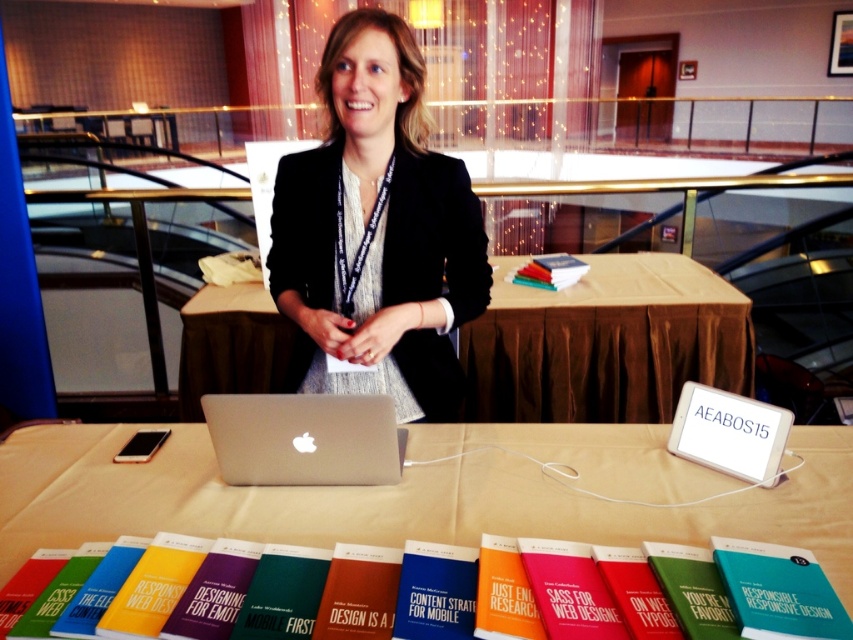
Question: Among these points, which one is farthest from the camera?

Choices:
 (A) (234, 392)
 (B) (424, 589)
 (C) (534, 260)
 (D) (386, 628)

Answer: (C)

Question: Which point is closer to the camera?

Choices:
 (A) (309, 467)
 (B) (581, 275)

Answer: (A)

Question: Is white plastic tablet at center bigger than blue hardcover book at center?

Choices:
 (A) no
 (B) yes

Answer: (B)

Question: Does black textured blazer at center have a larger size compared to matte green book at lower right?

Choices:
 (A) no
 (B) yes

Answer: (B)

Question: Which object appears closest to the camera in this image?

Choices:
 (A) blue hardcover book at center
 (B) matte red book at center
 (C) black textured blazer at center

Answer: (B)

Question: Is white plastic tablet at center wider than blue hardcover book at center?

Choices:
 (A) yes
 (B) no

Answer: (A)